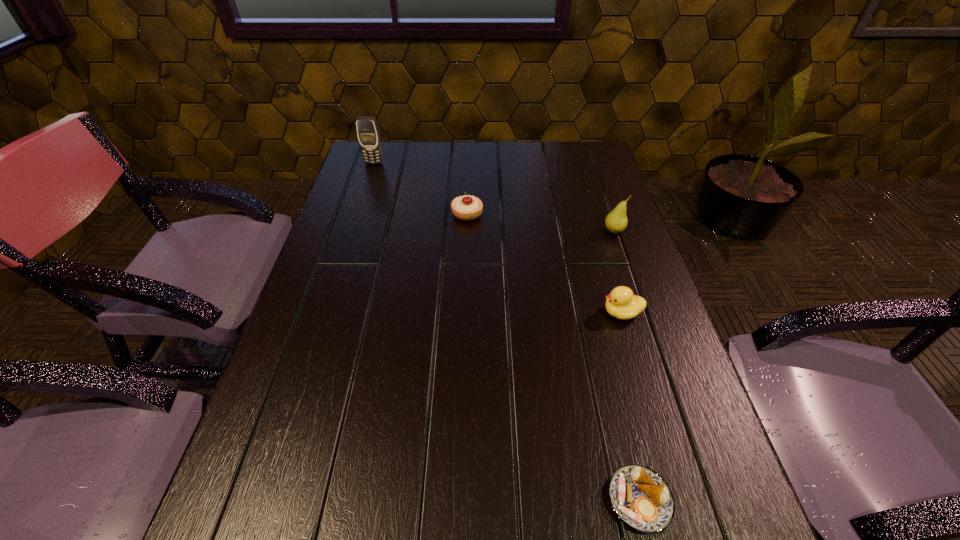
The height and width of the screenshot is (540, 960). Find the location of `vacant space that satisfies the following two spatial constraints: 1. on the front face of the third nearest object; 2. on the right side of the tallest object`. vacant space that satisfies the following two spatial constraints: 1. on the front face of the third nearest object; 2. on the right side of the tallest object is located at coordinates (351, 231).